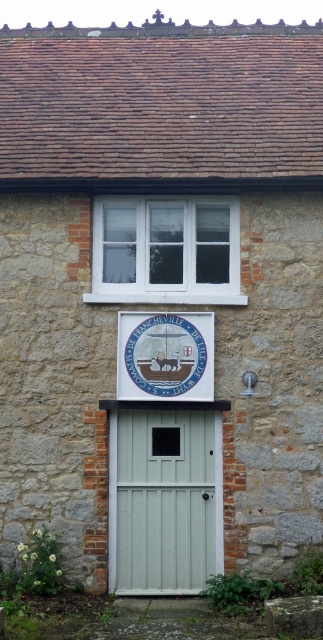
Question: Can you confirm if white plastic window at upper center is positioned to the left of matte blue seal at center?

Choices:
 (A) yes
 (B) no

Answer: (A)

Question: Is white painted wood door at center to the left of matte blue seal at center from the viewer's perspective?

Choices:
 (A) no
 (B) yes

Answer: (B)

Question: Which point appears closest to the camera in this image?

Choices:
 (A) (145, 332)
 (B) (105, 244)
 (C) (215, 536)

Answer: (A)

Question: Considering the relative positions of white plastic window at upper center and matte blue seal at center in the image provided, where is white plastic window at upper center located with respect to matte blue seal at center?

Choices:
 (A) left
 (B) right

Answer: (A)

Question: Which point is closer to the camera?

Choices:
 (A) (139, 348)
 (B) (177, 531)
 (C) (131, 228)

Answer: (A)

Question: Based on their relative distances, which object is farther from the white plastic window at upper center?

Choices:
 (A) matte blue seal at center
 (B) white painted wood door at center

Answer: (B)